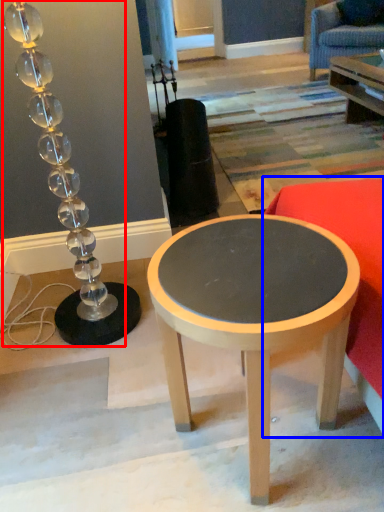
Question: Which object is closer to the camera taking this photo, lamp (highlighted by a red box) or studio couch (highlighted by a blue box)?

Choices:
 (A) lamp
 (B) studio couch

Answer: (B)